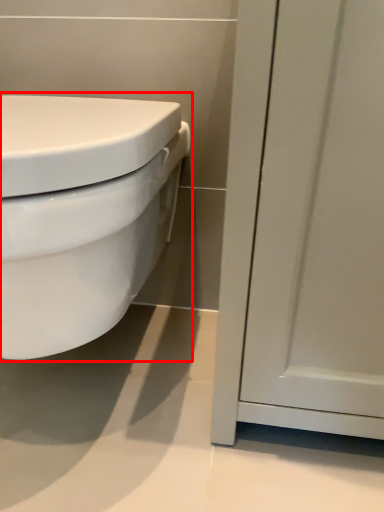
Question: Observing the image, what is the correct spatial positioning of toilet (annotated by the red box) in reference to screen door?

Choices:
 (A) left
 (B) right

Answer: (A)